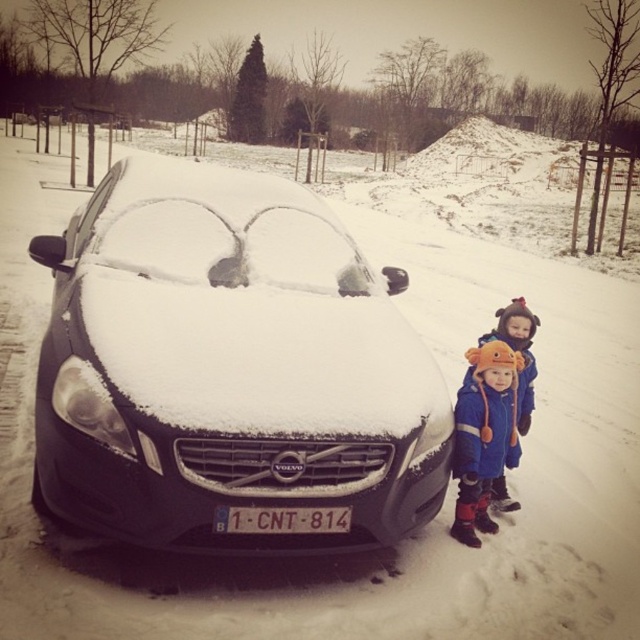
Based on the photo, you are a photographer trying to capture a photo of the orange fleece hat at lower right and the white plastic license plate at center. Which object should you zoom in more on to ensure both are clearly visible in the frame?

The orange fleece hat at lower right has a lesser width compared to white plastic license plate at center, so you should zoom in more on the orange fleece hat at lower right to ensure both are clearly visible in the frame.